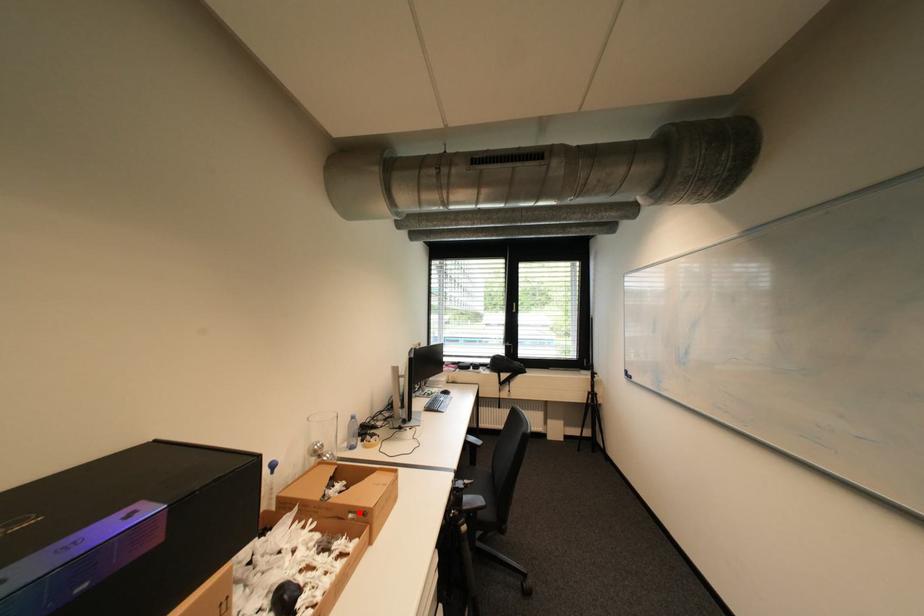
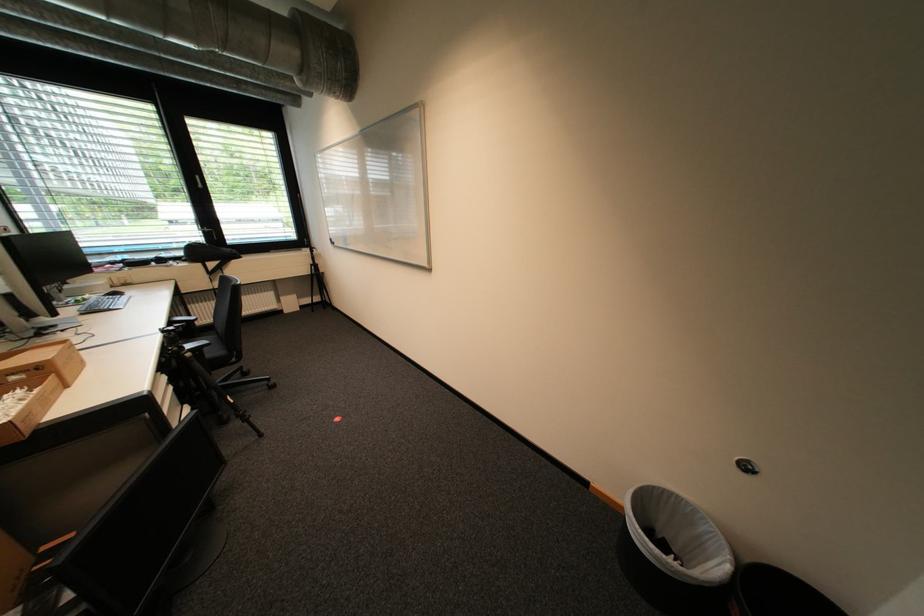
In the second image, find the point that corresponds to the highlighted location in the first image.

(20, 375)